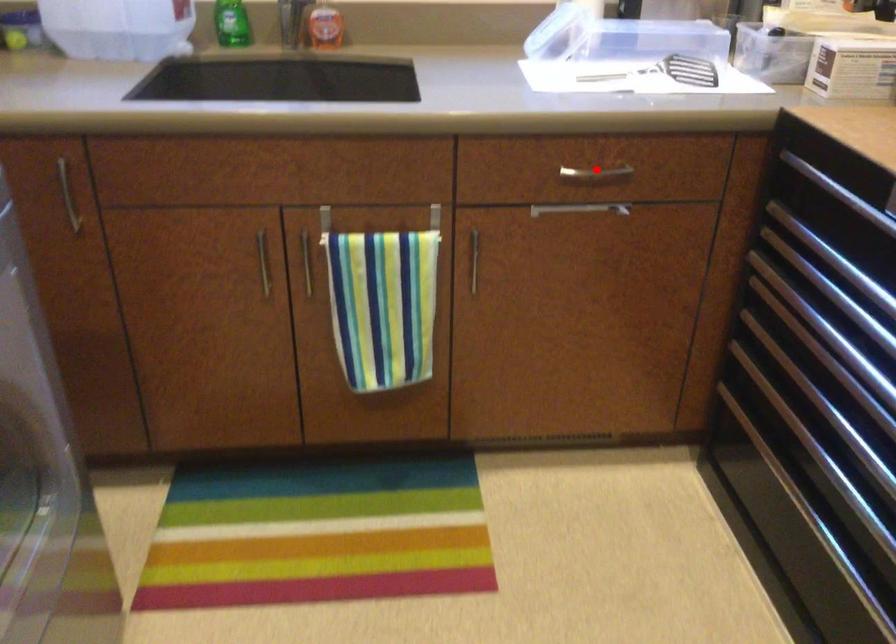
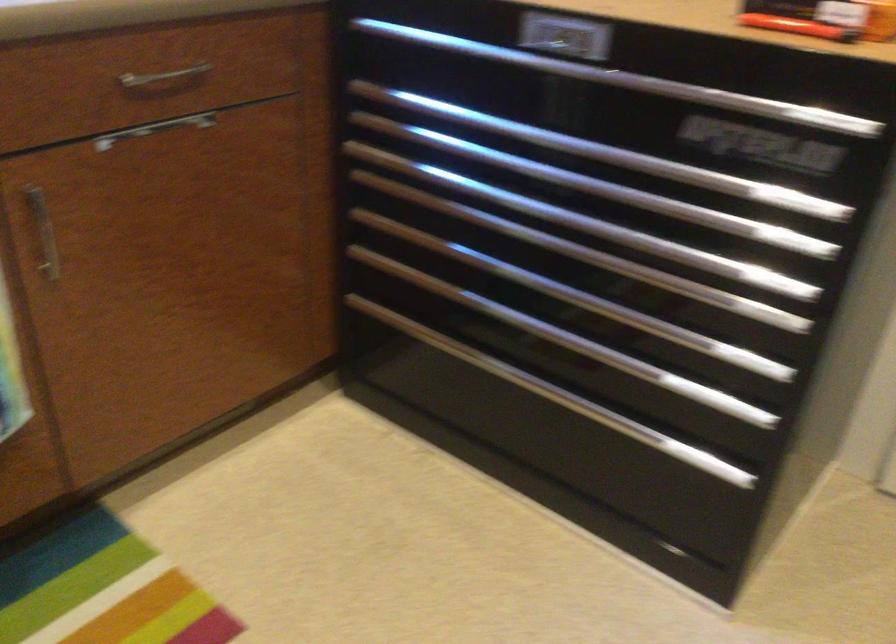
The point at the highlighted location is marked in the first image. Where is the corresponding point in the second image?

(164, 78)